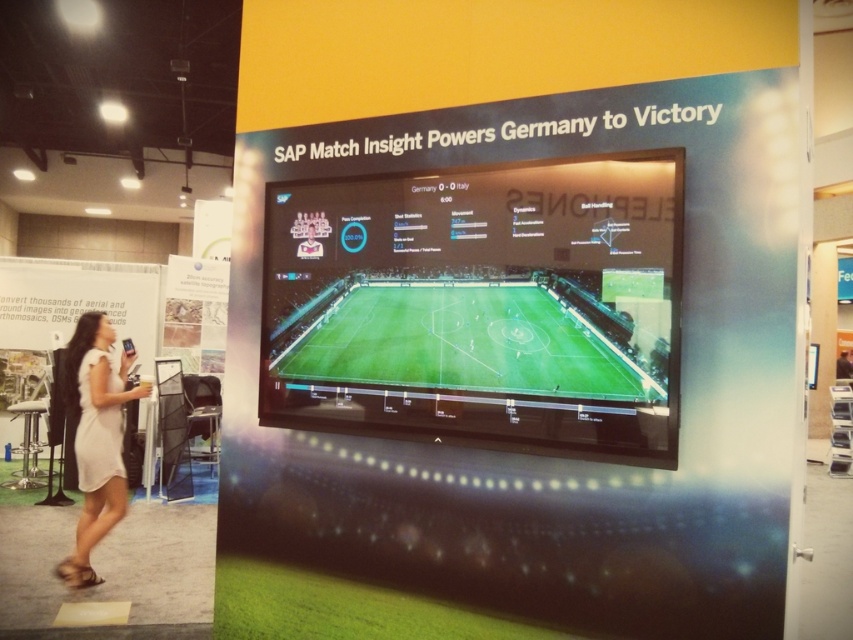
Does black glossy screen at center appear on the right side of green artificial turf at center?

No, black glossy screen at center is not to the right of green artificial turf at center.

Consider the image. Between black glossy screen at center and green artificial turf at center, which one is positioned higher?

Positioned higher is black glossy screen at center.

Locate an element on the screen. The image size is (853, 640). black glossy screen at center is located at coordinates (480, 307).

This screenshot has height=640, width=853. I want to click on black glossy screen at center, so click(x=480, y=307).

Does point (366, 301) lie in front of point (73, 566)?

Yes.

Is black glossy screen at center further to camera compared to white matte dress at lower left?

No, it is in front of white matte dress at lower left.

Between point (401, 376) and point (78, 404), which one is positioned behind?

The point (78, 404) is behind.

At what (x,y) coordinates should I click in order to perform the action: click on black glossy screen at center. Please return your answer as a coordinate pair (x, y). The width and height of the screenshot is (853, 640). Looking at the image, I should click on (480, 307).

Who is taller, green artificial turf at center or white matte dress at lower left?

Standing taller between the two is white matte dress at lower left.

Which is more to the left, green artificial turf at center or white matte dress at lower left?

From the viewer's perspective, white matte dress at lower left appears more on the left side.

You are a GUI agent. You are given a task and a screenshot of the screen. Output one action in this format:
    pyautogui.click(x=<x>, y=<y>)
    Task: Click on the green artificial turf at center
    
    Given the screenshot: What is the action you would take?
    pyautogui.click(x=469, y=340)

Where is `green artificial turf at center`? This screenshot has width=853, height=640. green artificial turf at center is located at coordinates (469, 340).